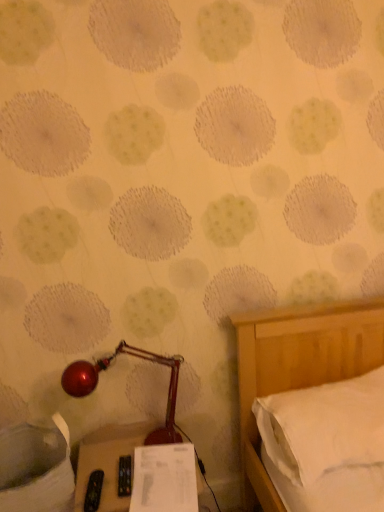
Where is `free space above black plastic remote control at lower center (from a real-world perspective)`? This screenshot has width=384, height=512. free space above black plastic remote control at lower center (from a real-world perspective) is located at coordinates (133, 468).